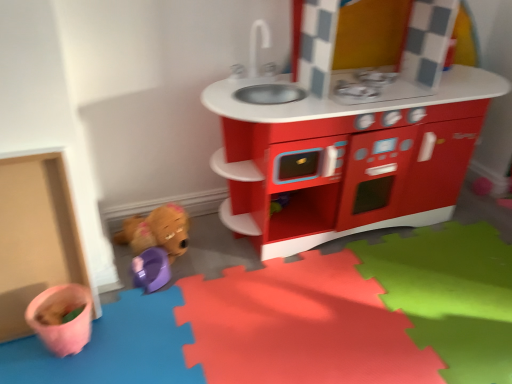
Question: Could you tell me if purple plastic toy at lower left, which is counted as the second toy, starting from the top, is turned towards matte plastic play kitchen at center?

Choices:
 (A) no
 (B) yes

Answer: (A)

Question: Does purple plastic toy at lower left, which is counted as the second toy, starting from the top, have a lesser height compared to matte plastic play kitchen at center?

Choices:
 (A) no
 (B) yes

Answer: (B)

Question: Can matte plastic play kitchen at center be found inside purple plastic toy at lower left, which is counted as the second toy, starting from the top?

Choices:
 (A) no
 (B) yes

Answer: (A)

Question: Is purple plastic toy at lower left, which is counted as the second toy, starting from the top, positioned far away from matte plastic play kitchen at center?

Choices:
 (A) yes
 (B) no

Answer: (B)

Question: From the image's perspective, would you say purple plastic toy at lower left, which ranks as the first toy in bottom-to-top order, is shown under matte plastic play kitchen at center?

Choices:
 (A) no
 (B) yes

Answer: (B)

Question: Can you confirm if purple plastic toy at lower left, which is counted as the second toy, starting from the top, is taller than matte plastic play kitchen at center?

Choices:
 (A) yes
 (B) no

Answer: (B)

Question: Is purple plastic toy at lower left, which is counted as the second toy, starting from the top, closer to camera compared to brown plush toy at lower left, which is the first toy from top to bottom?

Choices:
 (A) yes
 (B) no

Answer: (A)

Question: Is purple plastic toy at lower left, which is counted as the second toy, starting from the top, outside brown plush toy at lower left, arranged as the second toy when ordered from the bottom?

Choices:
 (A) no
 (B) yes

Answer: (A)

Question: Can you confirm if purple plastic toy at lower left, which ranks as the first toy in bottom-to-top order, is positioned to the left of brown plush toy at lower left, which is the first toy from top to bottom?

Choices:
 (A) yes
 (B) no

Answer: (A)

Question: Is purple plastic toy at lower left, which is counted as the second toy, starting from the top, bigger than brown plush toy at lower left, arranged as the second toy when ordered from the bottom?

Choices:
 (A) yes
 (B) no

Answer: (B)

Question: Can you confirm if purple plastic toy at lower left, which ranks as the first toy in bottom-to-top order, is shorter than brown plush toy at lower left, which is the first toy from top to bottom?

Choices:
 (A) yes
 (B) no

Answer: (A)

Question: Is purple plastic toy at lower left, which is counted as the second toy, starting from the top, at the right side of brown plush toy at lower left, arranged as the second toy when ordered from the bottom?

Choices:
 (A) yes
 (B) no

Answer: (B)

Question: From the image's perspective, is brown plush toy at lower left, which is the first toy from top to bottom, on matte plastic play kitchen at center?

Choices:
 (A) no
 (B) yes

Answer: (A)